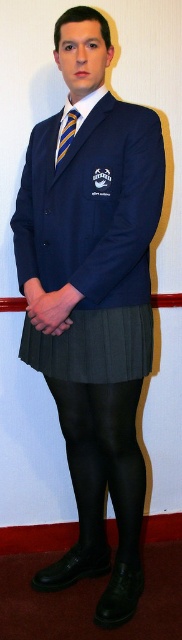
In the scene shown: You are a fashion designer trying to create a new outfit. You see the black tights at lower center and the dark grey pleated skirt at center. Which item is longer in height?

The black tights at lower center are much taller than the dark grey pleated skirt at center.

You are a photographer setting up for a portrait. You have two points marked on the floor where you need to place a spotlight and a reflector. The points are labeled as point 1 at (x=141, y=483) and point 2 at (x=84, y=339). According to the scene description, which point is further back from the camera, and thus better suited for placing the spotlight to highlight the subject from behind?

Point 1 at (x=141, y=483) is behind point 2 at (x=84, y=339), so it is further back from the camera. Therefore, placing the spotlight at point 1 at (x=141, y=483) would be better to highlight the subject from behind.

You are a fashion designer analyzing the outfit of a person in the image. Which item has a greater height between the dark grey pleated skirt at center and the striped fabric tie at center?

The dark grey pleated skirt at center has a greater height compared to the striped fabric tie at center.